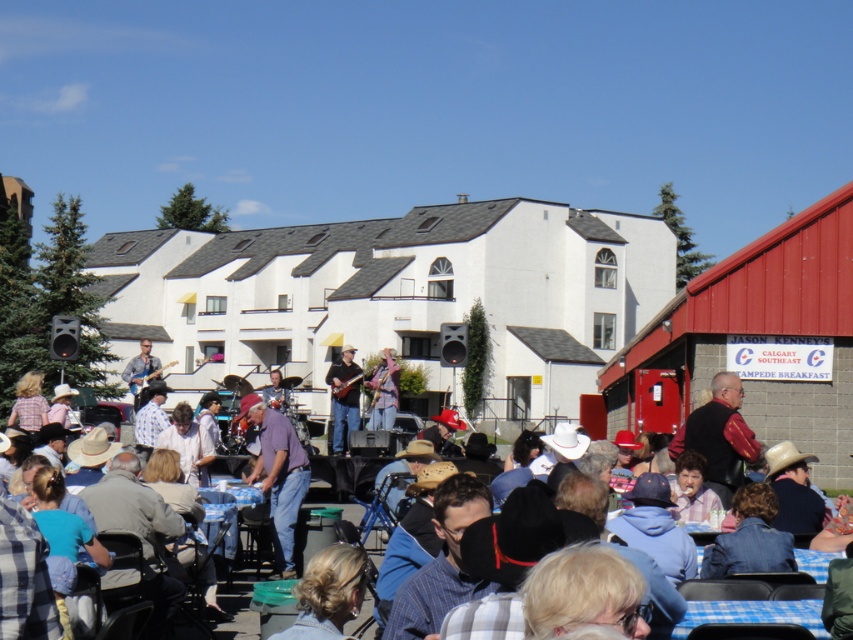
Question: Which of these objects is positioned farthest from the wooden guitar at center?

Choices:
 (A) matte brown guitar at center
 (B) purple cotton shirt at center
 (C) denim jacket at center

Answer: (C)

Question: Does matte brown guitar at center have a greater width compared to wooden guitar at center?

Choices:
 (A) no
 (B) yes

Answer: (B)

Question: Is purple cotton shirt at center to the left of denim jacket at center from the viewer's perspective?

Choices:
 (A) no
 (B) yes

Answer: (B)

Question: Where is purple cotton shirt at center located in relation to matte brown guitar at center in the image?

Choices:
 (A) below
 (B) above

Answer: (A)

Question: Which point appears farthest from the camera in this image?

Choices:
 (A) (682, 636)
 (B) (331, 406)
 (C) (244, 410)
 (D) (387, 410)

Answer: (B)

Question: Estimate the real-world distances between objects in this image. Which object is closer to the wooden guitar at center?

Choices:
 (A) matte brown guitar at center
 (B) denim jacket at center

Answer: (A)